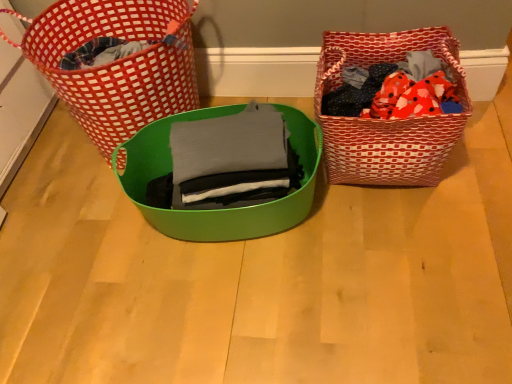
What is the approximate height of gray matte fabric at center?

The height of gray matte fabric at center is 7.94 inches.

In order to face gray matte fabric at center, should I rotate leftwards or rightwards?

You should rotate left by 4.135 degrees.

Looking at this image, measure the distance between green plastic bowl at center and camera.

A distance of 1.08 meters exists between green plastic bowl at center and camera.

Describe the element at coordinates (218, 209) in the screenshot. I see `green plastic bowl at center` at that location.

I want to click on gray matte fabric at center, so click(x=229, y=155).

Based on the photo, from the image's perspective, is red woven picnic basket at left, the first picnic basket positioned from the left, located above gray matte fabric at center?

Correct, red woven picnic basket at left, the first picnic basket positioned from the left, appears higher than gray matte fabric at center in the image.

Between red woven picnic basket at left, the 2th picnic basket positioned from the right, and gray matte fabric at center, which one is positioned behind?

red woven picnic basket at left, the 2th picnic basket positioned from the right.

Is gray matte fabric at center surrounded by red woven picnic basket at left, the 2th picnic basket positioned from the right?

Definitely not — gray matte fabric at center is not inside red woven picnic basket at left, the 2th picnic basket positioned from the right.

What's the angular difference between red woven picnic basket at left, the first picnic basket positioned from the left, and gray matte fabric at center's facing directions?

There is a 9.49-degree angle between the facing directions of red woven picnic basket at left, the first picnic basket positioned from the left, and gray matte fabric at center.

From a real-world perspective, is gray matte fabric at center on top of red woven picnic basket at right, which is counted as the first picnic basket, starting from the right?

Yes, from a real-world perspective, gray matte fabric at center is over red woven picnic basket at right, which is counted as the first picnic basket, starting from the right

Can you tell me how much gray matte fabric at center and red woven picnic basket at right, which is counted as the first picnic basket, starting from the right, differ in facing direction?

The angular difference between gray matte fabric at center and red woven picnic basket at right, which is counted as the first picnic basket, starting from the right, is 7.64 degrees.

Is gray matte fabric at center looking in the opposite direction of red woven picnic basket at right, which is the second picnic basket from left to right?

gray matte fabric at center is not turned away from red woven picnic basket at right, which is the second picnic basket from left to right.

Is gray matte fabric at center directly adjacent to red woven picnic basket at right, which is counted as the first picnic basket, starting from the right?

They are not placed beside each other.

Can you confirm if red woven picnic basket at left, the first picnic basket positioned from the left, is positioned to the left of red woven picnic basket at right, which is the second picnic basket from left to right?

Indeed, red woven picnic basket at left, the first picnic basket positioned from the left, is positioned on the left side of red woven picnic basket at right, which is the second picnic basket from left to right.

Does point (97, 123) come closer to viewer compared to point (340, 66)?

No, (97, 123) is behind (340, 66).

Considering the sizes of red woven picnic basket at left, the 2th picnic basket positioned from the right, and red woven picnic basket at right, which is the second picnic basket from left to right, in the image, is red woven picnic basket at left, the 2th picnic basket positioned from the right, taller or shorter than red woven picnic basket at right, which is the second picnic basket from left to right,?

red woven picnic basket at left, the 2th picnic basket positioned from the right, is taller than red woven picnic basket at right, which is the second picnic basket from left to right.

Locate an element on the screen. picnic basket above the red woven picnic basket at right, which is the second picnic basket from left to right (from a real-world perspective) is located at coordinates (116, 63).

Which of these two, red woven picnic basket at right, which is the second picnic basket from left to right, or red woven picnic basket at left, the 2th picnic basket positioned from the right, is wider?

red woven picnic basket at left, the 2th picnic basket positioned from the right, is wider.

Does red woven picnic basket at right, which is counted as the first picnic basket, starting from the right, appear on the left side of red woven picnic basket at left, the first picnic basket positioned from the left?

Incorrect, red woven picnic basket at right, which is counted as the first picnic basket, starting from the right, is not on the left side of red woven picnic basket at left, the first picnic basket positioned from the left.

Considering the relative sizes of red woven picnic basket at right, which is the second picnic basket from left to right, and gray matte fabric at center in the image provided, is red woven picnic basket at right, which is the second picnic basket from left to right, taller than gray matte fabric at center?

Yes.

In the scene shown: Is red woven picnic basket at right, which is counted as the first picnic basket, starting from the right, facing away from gray matte fabric at center?

No, red woven picnic basket at right, which is counted as the first picnic basket, starting from the right, is not facing the opposite direction of gray matte fabric at center.

Which is in front, red woven picnic basket at right, which is the second picnic basket from left to right, or gray matte fabric at center?

gray matte fabric at center is more forward.

Which is further, (327, 129) or (266, 137)?

The point (327, 129) is behind.

Which is more to the left, gray matte fabric at center or red woven picnic basket at left, the 2th picnic basket positioned from the right?

red woven picnic basket at left, the 2th picnic basket positioned from the right, is more to the left.

Considering the relative positions of gray matte fabric at center and red woven picnic basket at left, the 2th picnic basket positioned from the right, in the image provided, is gray matte fabric at center behind red woven picnic basket at left, the 2th picnic basket positioned from the right,?

No, it is not.

From a real-world perspective, which is physically above, gray matte fabric at center or red woven picnic basket at left, the first picnic basket positioned from the left?

In real-world perspective, gray matte fabric at center is above.

Between gray matte fabric at center and red woven picnic basket at left, the first picnic basket positioned from the left, which one has smaller width?

gray matte fabric at center.

From a real-world perspective, is green plastic bowl at center physically located above or below red woven picnic basket at right, which is the second picnic basket from left to right?

In terms of real-world spatial position, green plastic bowl at center is below red woven picnic basket at right, which is the second picnic basket from left to right.

The height and width of the screenshot is (384, 512). Find the location of `picnic basket that is the 1st object above the green plastic bowl at center (from a real-world perspective)`. picnic basket that is the 1st object above the green plastic bowl at center (from a real-world perspective) is located at coordinates (387, 120).

Is green plastic bowl at center directly adjacent to red woven picnic basket at right, which is counted as the first picnic basket, starting from the right?

green plastic bowl at center is not next to red woven picnic basket at right, which is counted as the first picnic basket, starting from the right, and they're not touching.

Which picnic basket is the 2nd one when counting from the back of the gray matte fabric at center? Please provide its 2D coordinates.

[(116, 63)]

What are the coordinates of `clothing below the red woven picnic basket at right, which is the second picnic basket from left to right (from the image's perspective)` in the screenshot? It's located at (229, 155).

Based on their spatial positions, is green plastic bowl at center or gray matte fabric at center further from red woven picnic basket at left, the 2th picnic basket positioned from the right?

gray matte fabric at center.

Looking at the image, which one is located closer to red woven picnic basket at right, which is the second picnic basket from left to right, green plastic bowl at center or red woven picnic basket at left, the 2th picnic basket positioned from the right?

green plastic bowl at center is positioned closer to the anchor red woven picnic basket at right, which is the second picnic basket from left to right.

Considering their positions, is red woven picnic basket at left, the 2th picnic basket positioned from the right, positioned closer to gray matte fabric at center than red woven picnic basket at right, which is counted as the first picnic basket, starting from the right?

red woven picnic basket at right, which is counted as the first picnic basket, starting from the right, lies closer to gray matte fabric at center than the other object.

Based on their spatial positions, is gray matte fabric at center or green plastic bowl at center closer to red woven picnic basket at right, which is the second picnic basket from left to right?

green plastic bowl at center lies closer to red woven picnic basket at right, which is the second picnic basket from left to right, than the other object.

From the image, which object appears to be farther from red woven picnic basket at right, which is the second picnic basket from left to right, gray matte fabric at center or red woven picnic basket at left, the first picnic basket positioned from the left?

Based on the image, red woven picnic basket at left, the first picnic basket positioned from the left, appears to be further to red woven picnic basket at right, which is the second picnic basket from left to right.

When comparing their distances from red woven picnic basket at right, which is the second picnic basket from left to right, does green plastic bowl at center or gray matte fabric at center seem further?

gray matte fabric at center is positioned further to the anchor red woven picnic basket at right, which is the second picnic basket from left to right.

Considering their positions, is green plastic bowl at center positioned further to gray matte fabric at center than red woven picnic basket at left, the 2th picnic basket positioned from the right?

red woven picnic basket at left, the 2th picnic basket positioned from the right, is further to gray matte fabric at center.

When comparing their distances from green plastic bowl at center, does gray matte fabric at center or red woven picnic basket at left, the 2th picnic basket positioned from the right, seem closer?

gray matte fabric at center is positioned closer to the anchor green plastic bowl at center.

Find the location of a particular element. This screenshot has width=512, height=384. gift basket located between red woven picnic basket at left, the 2th picnic basket positioned from the right, and red woven picnic basket at right, which is counted as the first picnic basket, starting from the right, in the left-right direction is located at coordinates (218, 209).

Locate an element on the screen. This screenshot has width=512, height=384. gift basket located between red woven picnic basket at left, the 2th picnic basket positioned from the right, and gray matte fabric at center in the left-right direction is located at coordinates (218, 209).

Identify the location of clothing located between green plastic bowl at center and red woven picnic basket at right, which is counted as the first picnic basket, starting from the right, in the left-right direction. (229, 155).

You are a GUI agent. You are given a task and a screenshot of the screen. Output one action in this format:
    pyautogui.click(x=<x>, y=<y>)
    Task: Click on the clothing between red woven picnic basket at left, the 2th picnic basket positioned from the right, and red woven picnic basket at right, which is counted as the first picnic basket, starting from the right
    The width and height of the screenshot is (512, 384).
    Given the screenshot: What is the action you would take?
    pyautogui.click(x=229, y=155)